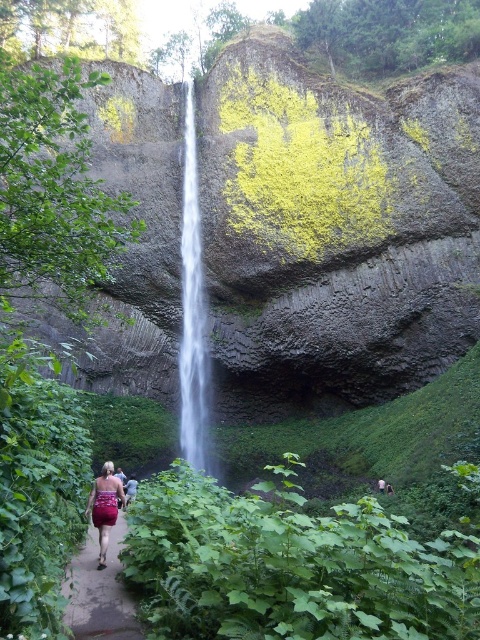
Question: Which of the following is the closest to the observer?

Choices:
 (A) (386, 490)
 (B) (99, 524)

Answer: (B)

Question: Considering the real-world distances, which object is farthest from the dark brown leather backpack at lower left?

Choices:
 (A) green leafy shrub at upper left
 (B) dark brown leather jacket at lower center
 (C) brown dirt path at lower center
 (D) green leafy plant at lower center

Answer: (A)

Question: Is clear glass waterfall at center bigger than brown dirt path at lower center?

Choices:
 (A) yes
 (B) no

Answer: (A)

Question: Can you confirm if clear glass waterfall at center is thinner than brown dirt path at lower center?

Choices:
 (A) no
 (B) yes

Answer: (B)

Question: Is green leafy shrub at upper left below maroon satin dress at lower center?

Choices:
 (A) yes
 (B) no

Answer: (B)

Question: Which is nearer to the maroon satin dress at lower center?

Choices:
 (A) dark brown leather backpack at lower left
 (B) green leafy shrub at upper left
 (C) dark brown leather jacket at lower center

Answer: (A)